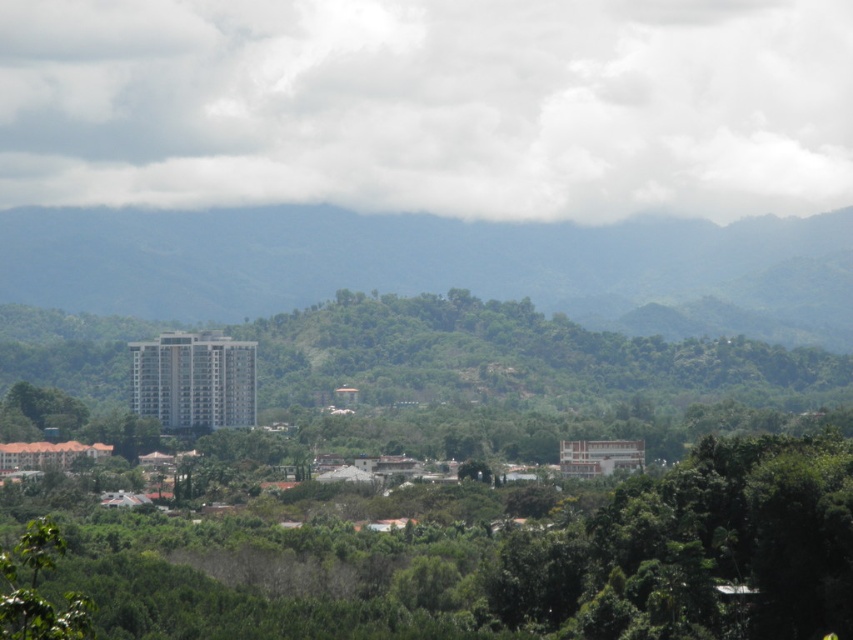
Can you confirm if white fluffy cloud at upper center is shorter than green leafy tree at center?

Incorrect, white fluffy cloud at upper center's height does not fall short of green leafy tree at center's.

Between point (643, 195) and point (596, 500), which one is positioned behind?

Point (643, 195)

Identify the location of white fluffy cloud at upper center. (430, 106).

In order to click on white fluffy cloud at upper center in this screenshot , I will do `click(430, 106)`.